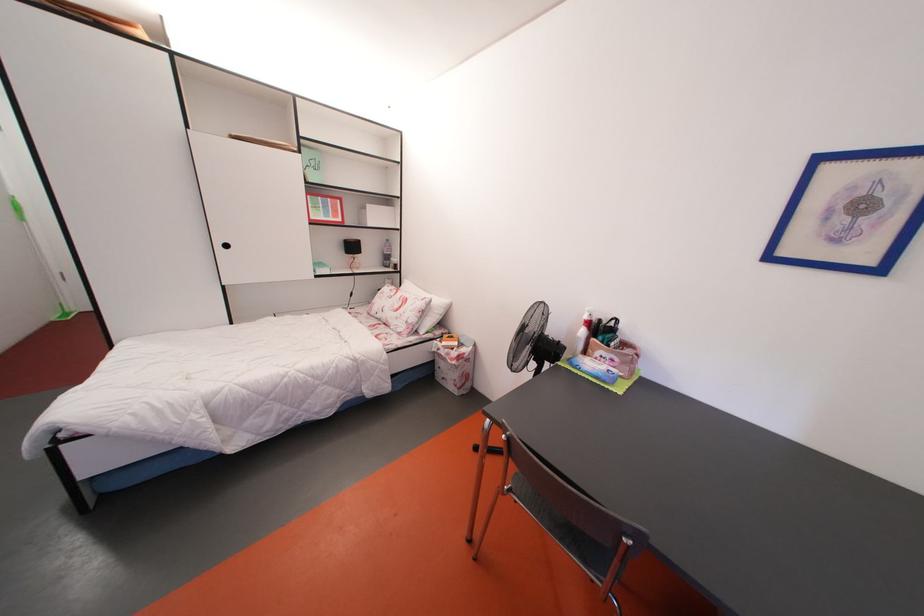
The height and width of the screenshot is (616, 924). Find the location of `white spray nozzle`. white spray nozzle is located at coordinates (582, 331).